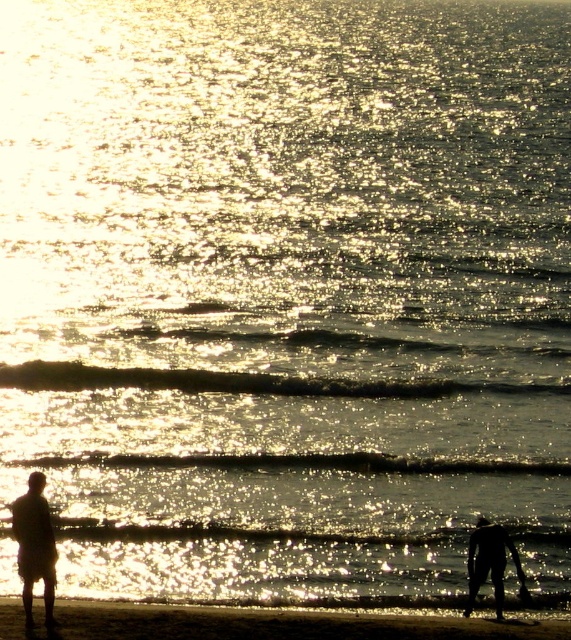
Question: Considering the relative positions of sandy beach at lower center and silhouette figure at left in the image provided, where is sandy beach at lower center located with respect to silhouette figure at left?

Choices:
 (A) above
 (B) below

Answer: (B)

Question: Among these points, which one is farthest from the camera?

Choices:
 (A) (30, 616)
 (B) (480, 518)
 (C) (324, 612)

Answer: (B)

Question: Where is silhouette figure at left located in relation to black matte figure at lower right in the image?

Choices:
 (A) below
 (B) above

Answer: (B)

Question: Which object is the farthest from the black matte figure at lower right?

Choices:
 (A) silhouette figure at left
 (B) sandy beach at lower center

Answer: (A)

Question: In this image, where is sandy beach at lower center located relative to black matte figure at lower right?

Choices:
 (A) above
 (B) below

Answer: (B)

Question: Which of the following is the farthest from the observer?

Choices:
 (A) sandy beach at lower center
 (B) silhouette figure at left
 (C) black matte figure at lower right

Answer: (C)